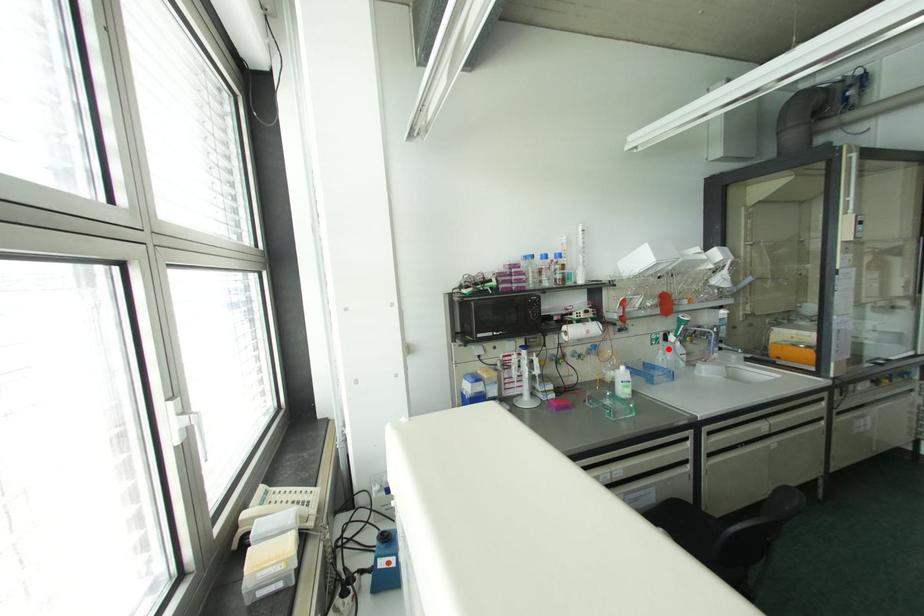
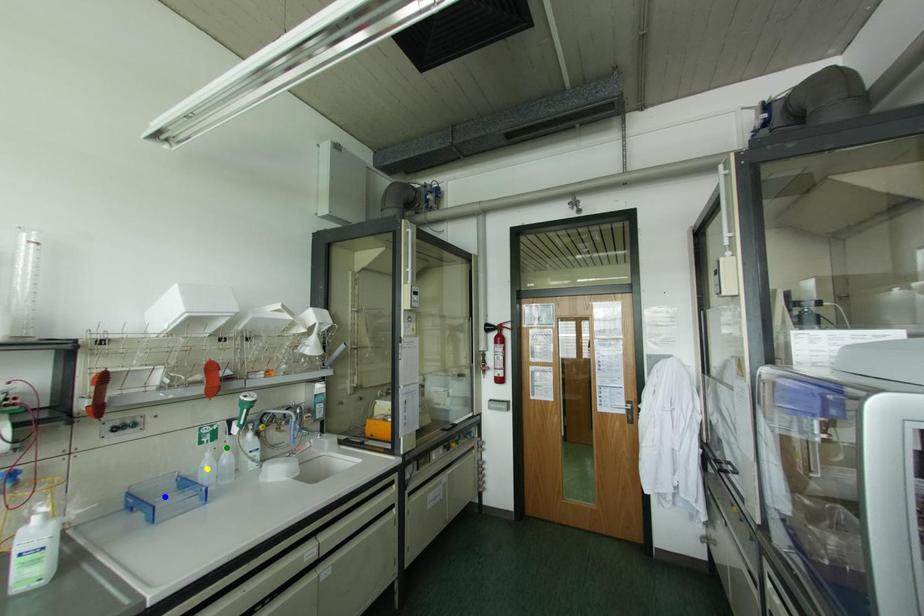
Question: I am providing you with two images of the same scene from different viewpoints. A red point is marked on the first image. You are given multiple points on the second image. Which point in image 2 is actually the same real-world point as the red point in image 1?

Choices:
 (A) green point
 (B) blue point
 (C) yellow point

Answer: (A)